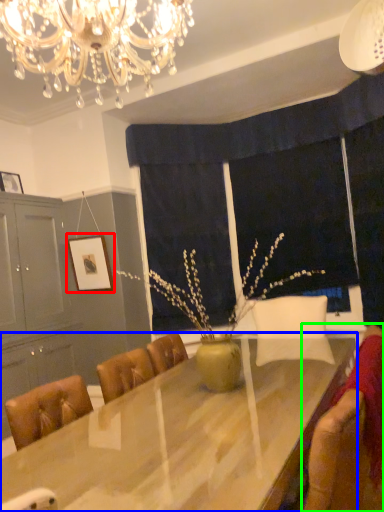
Question: Considering the real-world distances, which object is closest to picture frame (highlighted by a red box)? table (highlighted by a blue box) or swivel chair (highlighted by a green box).

Choices:
 (A) table
 (B) swivel chair

Answer: (A)